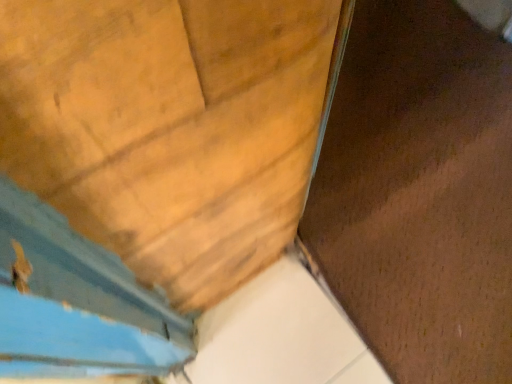
Image resolution: width=512 pixels, height=384 pixels. What do you see at coordinates (177, 135) in the screenshot?
I see `wooden door at center` at bounding box center [177, 135].

The width and height of the screenshot is (512, 384). I want to click on wooden door at center, so click(x=177, y=135).

You are a GUI agent. You are given a task and a screenshot of the screen. Output one action in this format:
    pyautogui.click(x=<x>, y=<y>)
    Task: Click on the brown matte plywood at center
    The image size is (512, 384).
    Given the screenshot: What is the action you would take?
    pyautogui.click(x=420, y=192)

The width and height of the screenshot is (512, 384). What do you see at coordinates (420, 192) in the screenshot?
I see `brown matte plywood at center` at bounding box center [420, 192].

At what (x,y) coordinates should I click in order to perform the action: click on wooden door at center. Please return your answer as a coordinate pair (x, y). The width and height of the screenshot is (512, 384). Looking at the image, I should click on (177, 135).

Is brown matte plywood at center at the right side of wooden door at center?

Yes.

Between brown matte plywood at center and wooden door at center, which one is positioned in front?

wooden door at center is in front.

Which is closer, (442, 327) or (227, 311)?

Point (442, 327)

From the image's perspective, which one is positioned lower, brown matte plywood at center or wooden door at center?

wooden door at center appears lower in the image.

Consider the image. From a real-world perspective, which is physically above, brown matte plywood at center or wooden door at center?

In real-world perspective, wooden door at center is above.

Is brown matte plywood at center wider or thinner than wooden door at center?

Considering their sizes, brown matte plywood at center looks broader than wooden door at center.

Is brown matte plywood at center taller or shorter than wooden door at center?

Considering their sizes, brown matte plywood at center has less height than wooden door at center.

Considering the relative sizes of brown matte plywood at center and wooden door at center in the image provided, is brown matte plywood at center smaller than wooden door at center?

No.

Is brown matte plywood at center spatially inside wooden door at center, or outside of it?

brown matte plywood at center is not enclosed by wooden door at center.

Is brown matte plywood at center far from wooden door at center?

That's not correct — brown matte plywood at center is a little close to wooden door at center.

Is brown matte plywood at center facing away from wooden door at center?

No, wooden door at center is not at the back of brown matte plywood at center.

How different are the orientations of brown matte plywood at center and wooden door at center in degrees?

They differ by 178 degrees in their facing directions.

Locate an element on the screen. The image size is (512, 384). door below the brown matte plywood at center (from the image's perspective) is located at coordinates (x=177, y=135).

Considering the positions of objects wooden door at center and brown matte plywood at center in the image provided, who is more to the left, wooden door at center or brown matte plywood at center?

Positioned to the left is wooden door at center.

Which object is further away from the camera taking this photo, wooden door at center or brown matte plywood at center?

brown matte plywood at center is behind.

Is point (58, 172) closer to camera compared to point (400, 336)?

Yes, point (58, 172) is in front of point (400, 336).

From the image's perspective, who appears lower, wooden door at center or brown matte plywood at center?

From the image's view, wooden door at center is below.

From a real-world perspective, which is physically below, wooden door at center or brown matte plywood at center?

brown matte plywood at center is physically lower.

Can you confirm if wooden door at center is wider than brown matte plywood at center?

In fact, wooden door at center might be narrower than brown matte plywood at center.

Does wooden door at center have a lesser height compared to brown matte plywood at center?

Incorrect, the height of wooden door at center does not fall short of that of brown matte plywood at center.

Considering the sizes of objects wooden door at center and brown matte plywood at center in the image provided, who is bigger, wooden door at center or brown matte plywood at center?

With larger size is brown matte plywood at center.

Is brown matte plywood at center a part of wooden door at center?

No, wooden door at center does not contain brown matte plywood at center.

Is wooden door at center with brown matte plywood at center?

They are not placed beside each other.

Is wooden door at center looking in the opposite direction of brown matte plywood at center?

That's not correct — wooden door at center is not looking away from brown matte plywood at center.

What's the angular difference between wooden door at center and brown matte plywood at center's facing directions?

They differ by 178 degrees in their facing directions.

Measure the distance between wooden door at center and brown matte plywood at center.

wooden door at center and brown matte plywood at center are 21.11 inches apart from each other.

Find the location of `door located above the brown matte plywood at center (from a real-world perspective)`. door located above the brown matte plywood at center (from a real-world perspective) is located at coordinates (177, 135).

The height and width of the screenshot is (384, 512). What are the coordinates of `door lying in front of the brown matte plywood at center` in the screenshot? It's located at (177, 135).

You are a GUI agent. You are given a task and a screenshot of the screen. Output one action in this format:
    pyautogui.click(x=<x>, y=<y>)
    Task: Click on the door below the brown matte plywood at center (from the image's perspective)
    
    Given the screenshot: What is the action you would take?
    pyautogui.click(x=177, y=135)